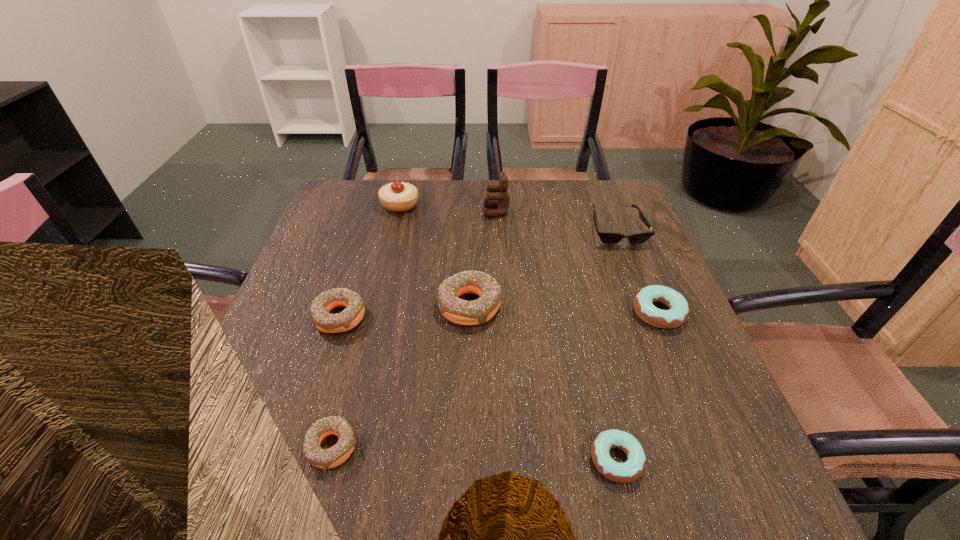
Image resolution: width=960 pixels, height=540 pixels. Identify the location of the left blue doughnut. (633, 468).

Locate an element on the screen. the sixth object from left to right is located at coordinates (633, 468).

What are the coordinates of `vacant position located 0.050m on the face of the teddy bear` in the screenshot? It's located at (468, 211).

Image resolution: width=960 pixels, height=540 pixels. In order to click on vacant space positioned 0.090m on the face of the teddy bear in this screenshot , I will do `click(454, 211)`.

This screenshot has height=540, width=960. Identify the location of vacant space situated on the face of the teddy bear. (363, 211).

In order to click on vacant area located 0.130m on the front of the seventh shortest object in this screenshot , I will do `click(391, 243)`.

Image resolution: width=960 pixels, height=540 pixels. I want to click on vacant region located 0.200m on the left of the third doughnut from right to left, so click(x=351, y=305).

Identify the location of vacant space located on the front-facing side of the sunglasses. Image resolution: width=960 pixels, height=540 pixels. (642, 294).

At what (x,y) coordinates should I click in order to perform the action: click on free space located on the right of the second smallest chocolate doughnut. Please return your answer as a coordinate pair (x, y). The height and width of the screenshot is (540, 960). Looking at the image, I should click on (516, 317).

Locate an element on the screen. vacant space located 0.300m on the left of the farther blue doughnut is located at coordinates (500, 312).